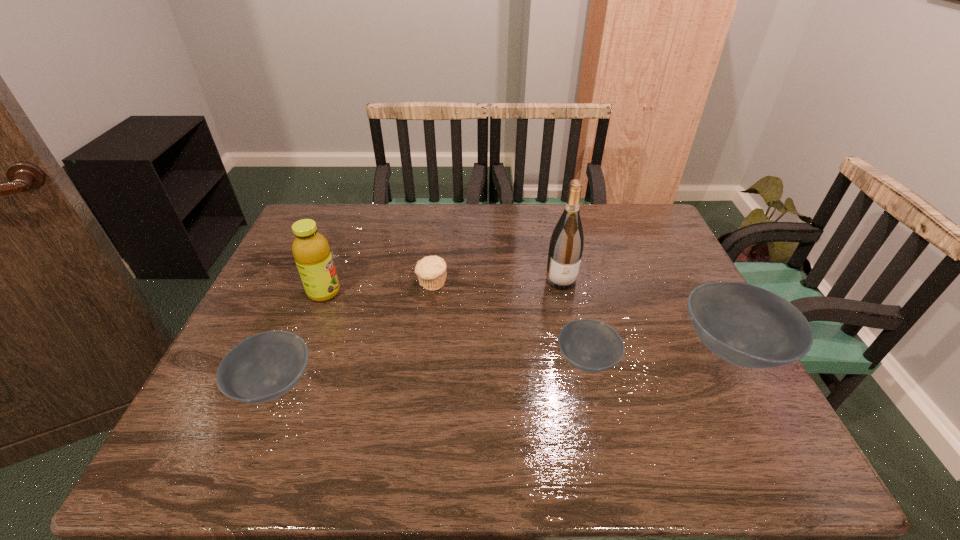
At what (x,y) coordinates should I click in order to perform the action: click on free point between the fourth shortest object and the fourth object from right to left. Please return your answer as a coordinate pair (x, y). This screenshot has width=960, height=540. Looking at the image, I should click on (582, 316).

Find the location of a particular element. empty space that is in between the leftmost bowl and the third object from left to right is located at coordinates (353, 334).

Select which object is the closest to the muffin. Please provide its 2D coordinates. Your answer should be formatted as a tuple, i.e. [(x, y)], where the tuple contains the x and y coordinates of a point satisfying the conditions above.

[(311, 251)]

Where is `object that can be found as the fifth closest to the leftmost bowl`? object that can be found as the fifth closest to the leftmost bowl is located at coordinates (748, 326).

Point out which bowl is positioned as the second nearest to the tallest bowl. Please provide its 2D coordinates. Your answer should be formatted as a tuple, i.e. [(x, y)], where the tuple contains the x and y coordinates of a point satisfying the conditions above.

[(263, 367)]

Locate an element on the screen. This screenshot has width=960, height=540. bowl identified as the closest to the second bowl from left to right is located at coordinates (748, 326).

Locate an element on the screen. free location that satisfies the following two spatial constraints: 1. on the front label of the fruit juice; 2. on the back side of the third tallest object is located at coordinates (302, 349).

This screenshot has width=960, height=540. In order to click on free point that satisfies the following two spatial constraints: 1. on the front label of the shortest bowl; 2. on the right side of the second tallest object in this screenshot , I will do `click(298, 360)`.

Where is `free space in the image that satisfies the following two spatial constraints: 1. on the front label of the second tallest object; 2. on the front side of the leftmost bowl`? This screenshot has width=960, height=540. free space in the image that satisfies the following two spatial constraints: 1. on the front label of the second tallest object; 2. on the front side of the leftmost bowl is located at coordinates click(x=288, y=385).

At what (x,y) coordinates should I click in order to perform the action: click on free point that satisfies the following two spatial constraints: 1. on the front label of the rightmost object; 2. on the left side of the fifth shortest object. Please return your answer as a coordinate pair (x, y). Looking at the image, I should click on (302, 349).